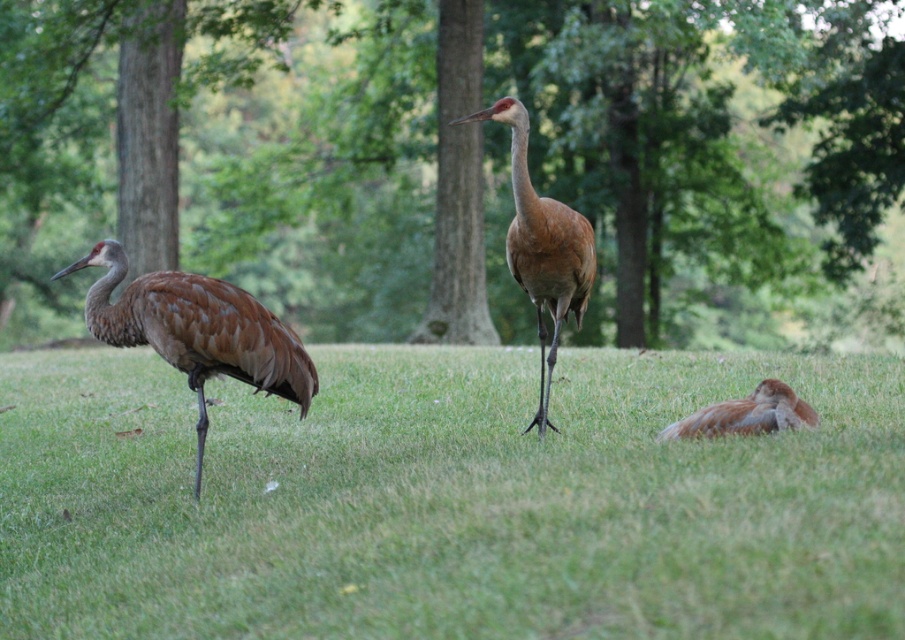
You are a wildlife photographer trying to capture a photo of the brown feathered crane at center and the brown feathered bird at lower right. Which one should you focus on first if you want to include both in the frame without moving your camera?

The brown feathered crane at center is larger in size than the brown feathered bird at lower right, so you should focus on the brown feathered crane at center first to ensure it fits properly in the frame before adjusting for the smaller bird.

You are a photographer trying to capture a closeup of the crane lying down. You have two points marked in the image for focus adjustment. The first point is at coordinate point (450, 278) and the second is at point (220, 307). Which point should you focus on to ensure the crane lying down is in focus?

Point (450, 278) is further to the camera than point (220, 307). Therefore, to focus on the crane lying down, you should select point (450, 278) as it is closer to the camera and likely aligned with the crane.

You are a birdwatcher observing the scene. You notice the brown feathered crane at left and the brown textured tree at center. Which one is taller?

The brown textured tree at center is taller than the brown feathered crane at left.